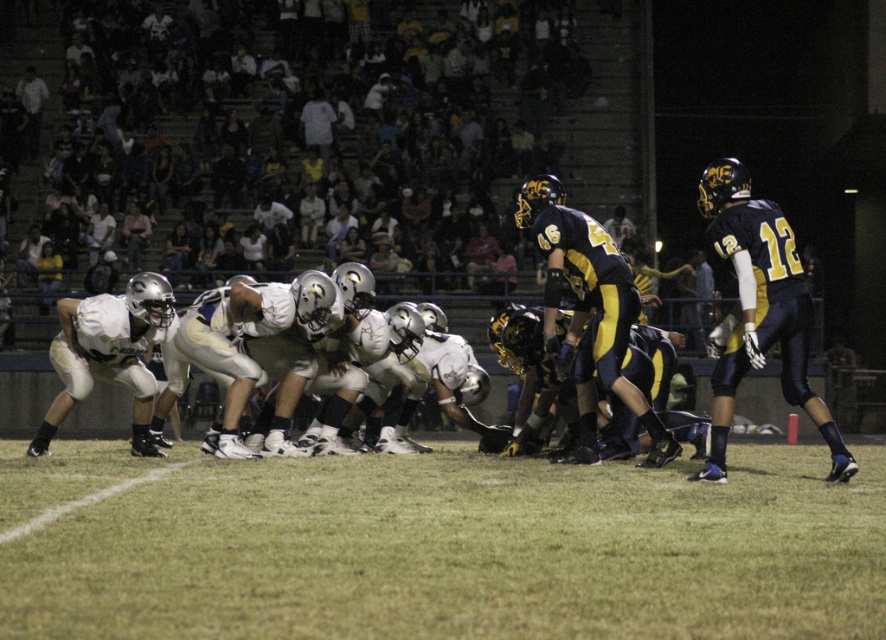
You are a player on the field and need to kick the ball from the green grass at center to the end zone, which is 6.60 meters away. Can you make the kick?

The distance between the green grass at center and the end zone is 6.60 meters, so yes, the kick is possible if the player can kick the ball that far.

You are a player in the nighttime football game scene. You need to pass the ball to your teammate wearing the white matte uniform at center. Where should you aim relative to the green grass at center?

You should aim to the right side of the green grass at center because the white matte uniform at center is positioned to the right of it.